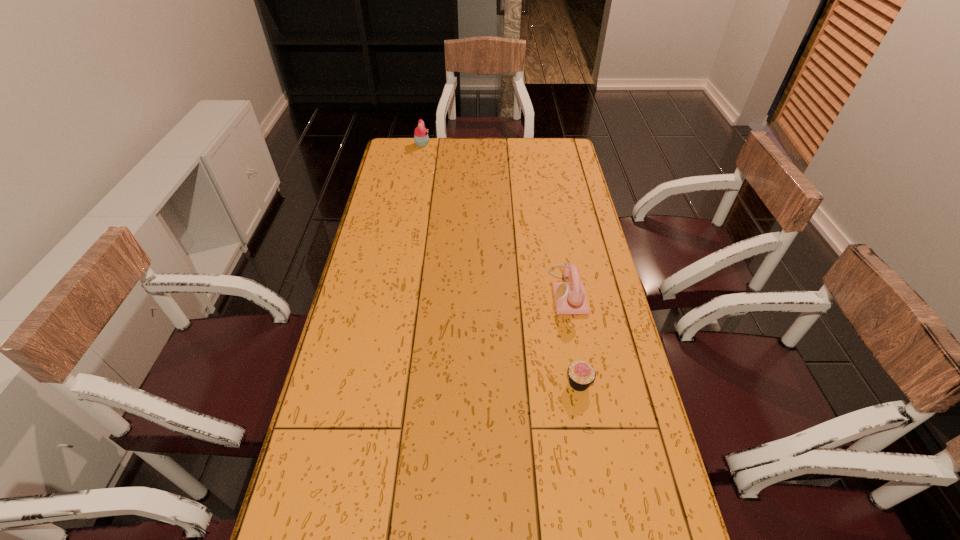
This screenshot has width=960, height=540. I want to click on object located in the far edge section of the desktop, so click(421, 138).

You are a GUI agent. You are given a task and a screenshot of the screen. Output one action in this format:
    pyautogui.click(x=<x>, y=<y>)
    Task: Click on the object that is at the left edge
    The width and height of the screenshot is (960, 540).
    Given the screenshot: What is the action you would take?
    pyautogui.click(x=421, y=138)

This screenshot has height=540, width=960. I want to click on telephone positioned at the right edge, so click(570, 298).

Image resolution: width=960 pixels, height=540 pixels. Identify the location of cupcake at the right edge. (581, 374).

Where is `object that is at the far left corner`? The width and height of the screenshot is (960, 540). object that is at the far left corner is located at coordinates (421, 138).

Image resolution: width=960 pixels, height=540 pixels. In order to click on vacant space at the far edge of the desktop in this screenshot , I will do `click(429, 160)`.

The image size is (960, 540). In the image, there is a desktop. In order to click on free region at the left edge in this screenshot , I will do `click(370, 326)`.

Locate an element on the screen. The image size is (960, 540). free space at the right edge of the desktop is located at coordinates (634, 453).

Find the location of `vacant region at the far left corner of the desktop`. vacant region at the far left corner of the desktop is located at coordinates (393, 157).

Locate an element on the screen. This screenshot has height=540, width=960. free space at the far right corner is located at coordinates (538, 153).